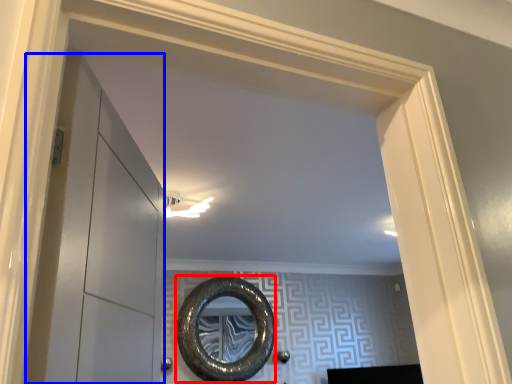
Question: Which of the following is the farthest to the observer, oval (highlighted by a red box) or glass door (highlighted by a blue box)?

Choices:
 (A) oval
 (B) glass door

Answer: (A)